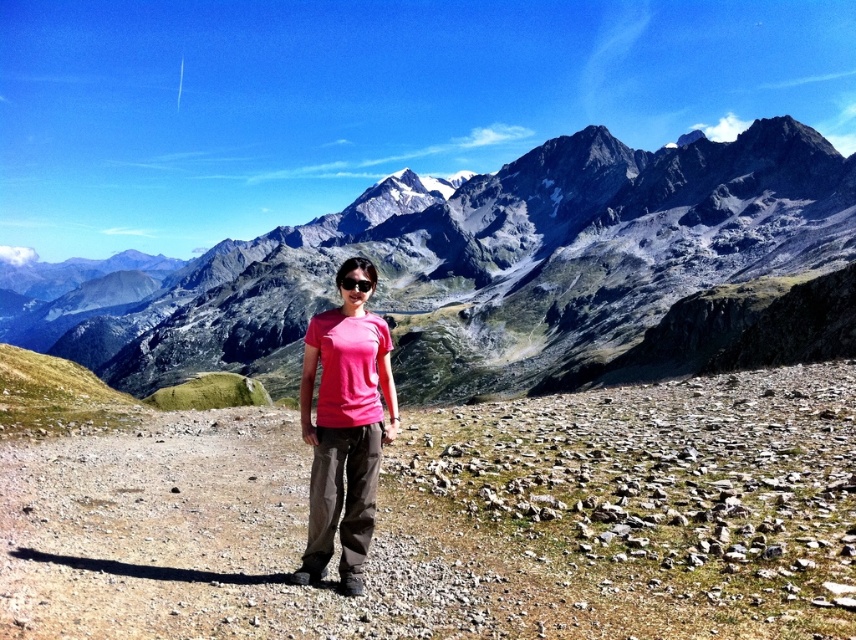
How distant is green grassy hillside at left from matte black goggles at center?

green grassy hillside at left and matte black goggles at center are 39.12 meters apart.

Is point (19, 397) closer to viewer compared to point (345, 285)?

No.

Locate an element on the screen. green grassy hillside at left is located at coordinates (56, 394).

Is rocky gray mountain range at center above pink fabric shirt at center?

Yes, rocky gray mountain range at center is above pink fabric shirt at center.

Does rocky gray mountain range at center appear under pink fabric shirt at center?

No.

Who is more distant from viewer, [104,355] or [343,294]?

The point [104,355] is behind.

Find the location of a particular element. This screenshot has width=856, height=640. rocky gray mountain range at center is located at coordinates (503, 266).

Does pink fabric shirt at center come behind green grassy hillside at left?

No, it is in front of green grassy hillside at left.

Between pink fabric shirt at center and green grassy hillside at left, which one appears on the left side from the viewer's perspective?

From the viewer's perspective, green grassy hillside at left appears more on the left side.

Who is more distant from viewer, (358, 445) or (107, 424)?

Point (107, 424)

The width and height of the screenshot is (856, 640). In order to click on pink fabric shirt at center in this screenshot , I will do `click(343, 433)`.